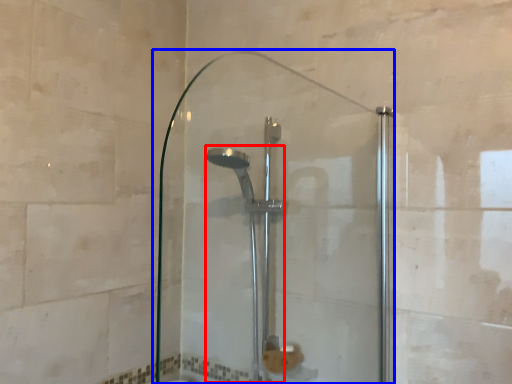
Question: Which of the following is the closest to the observer, shower (highlighted by a red box) or screen door (highlighted by a blue box)?

Choices:
 (A) shower
 (B) screen door

Answer: (B)